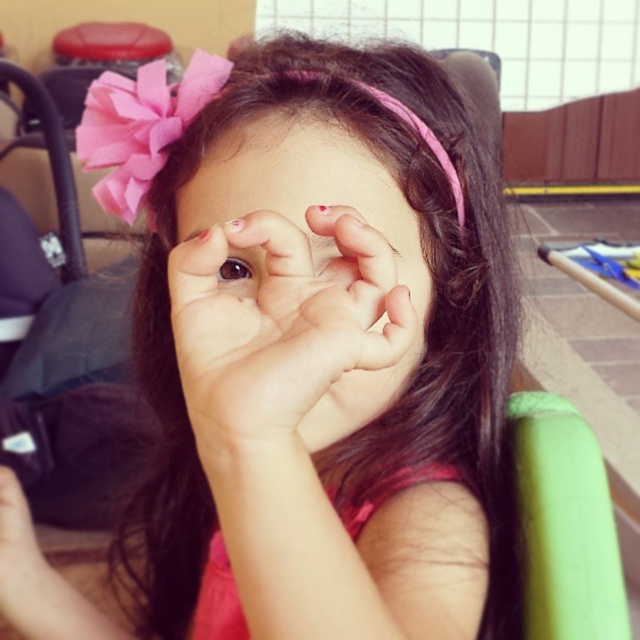
The young girl in the image is covering her face with her hands. Based on the scene description, which object is positioned higher relative to the other? Please refer to the objects listed below for your answer. Objects to consider are smooth skin face at center and brown shiny eye at center.

The smooth skin face at center is above the brown shiny eye at center.